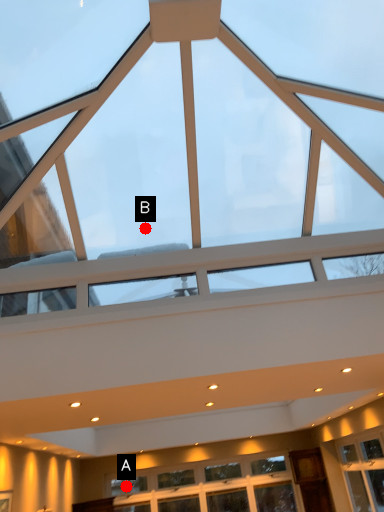
Question: Two points are circled on the image, labeled by A and B beside each circle. Which point is closer to the camera?

Choices:
 (A) A is closer
 (B) B is closer

Answer: (B)